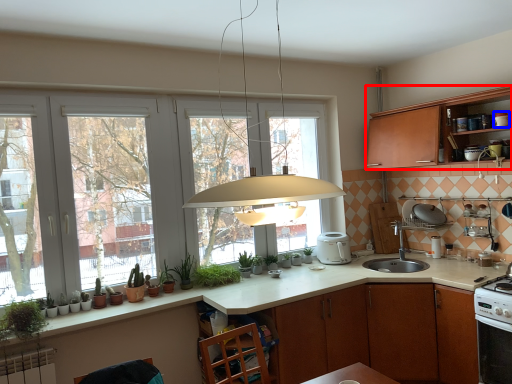
Question: Which object is further to the camera taking this photo, cabinetry (highlighted by a red box) or appliance (highlighted by a blue box)?

Choices:
 (A) cabinetry
 (B) appliance

Answer: (B)